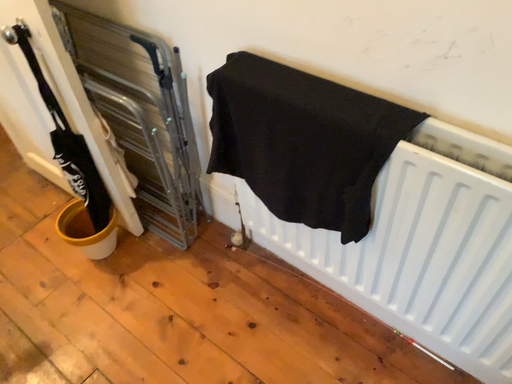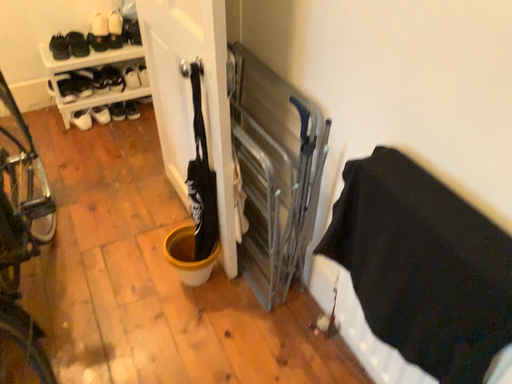
Question: Which way did the camera rotate in the video?

Choices:
 (A) rotated left
 (B) rotated right

Answer: (A)